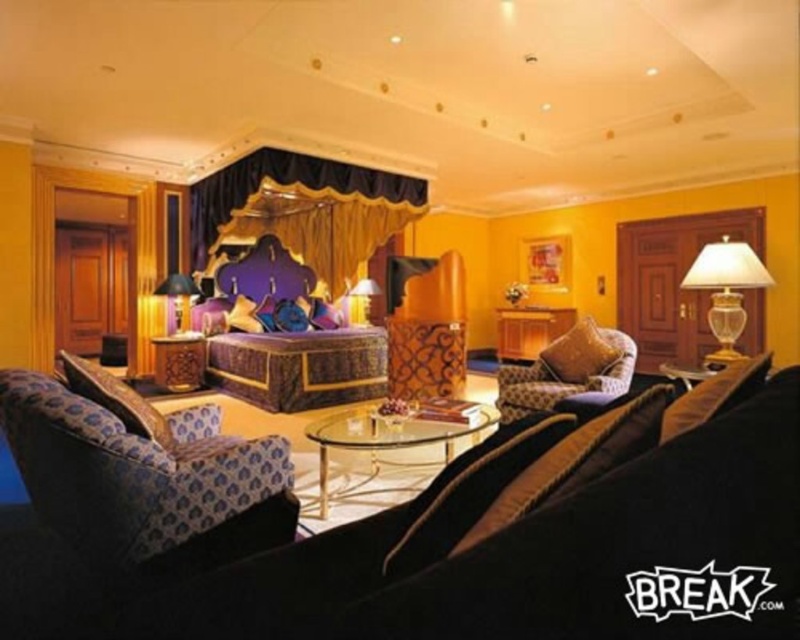
Question: Can you confirm if patterned fabric armchair at lower left is positioned below matte black lamp at left?

Choices:
 (A) yes
 (B) no

Answer: (A)

Question: Among these objects, which one is farthest from the camera?

Choices:
 (A) velvet dark brown couch at lower center
 (B) patterned fabric armchair at center

Answer: (B)

Question: Which point is closer to the camera taking this photo?

Choices:
 (A) (370, 298)
 (B) (601, 369)
 (C) (732, 305)

Answer: (C)

Question: Considering the relative positions of velvet dark brown couch at lower center and patterned fabric armchair at center in the image provided, where is velvet dark brown couch at lower center located with respect to patterned fabric armchair at center?

Choices:
 (A) left
 (B) right

Answer: (A)

Question: Does gold textured pillow at center appear under matte gold lamp at center?

Choices:
 (A) yes
 (B) no

Answer: (A)

Question: Based on their relative distances, which object is nearer to the translucent glass lampshade at right?

Choices:
 (A) velvet dark brown couch at lower center
 (B) matte black lamp at left

Answer: (A)